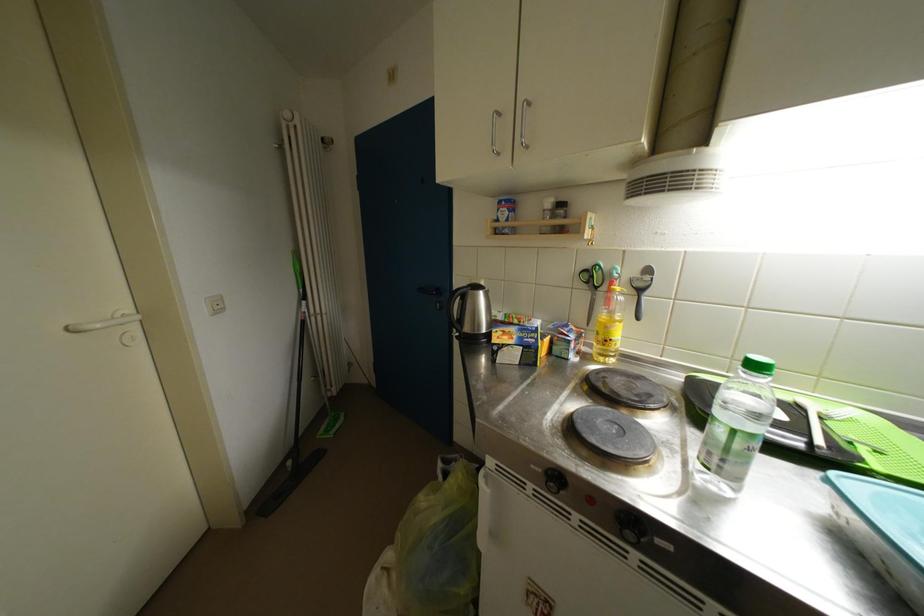
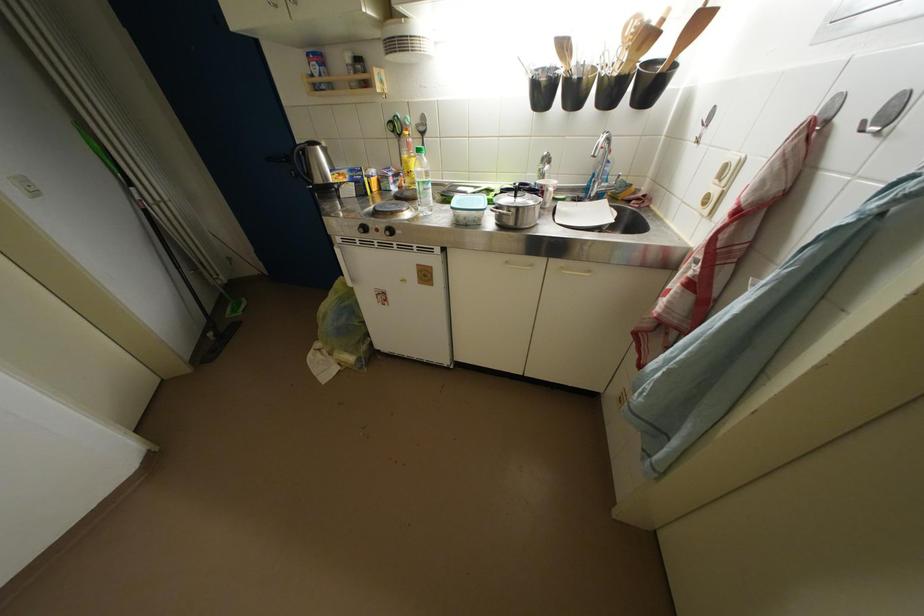
Where in the second image is the point corresponding to (614,331) from the first image?

(412, 167)